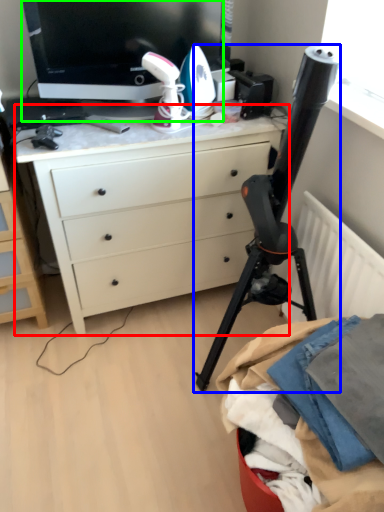
Question: Estimate the real-world distances between objects in this image. Which object is farther from desk (highlighted by a red box), tripod (highlighted by a blue box) or television (highlighted by a green box)?

Choices:
 (A) tripod
 (B) television

Answer: (B)